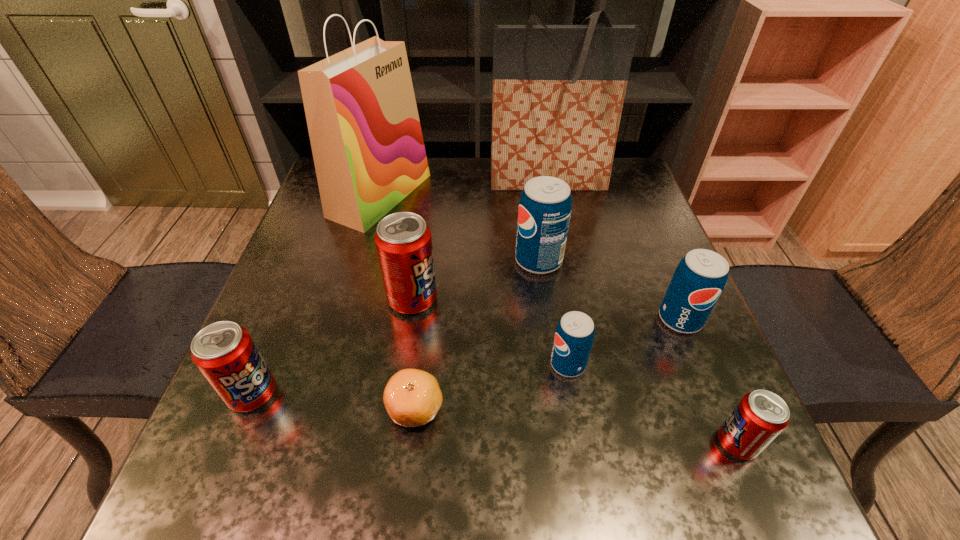
At what (x,y) coordinates should I click in order to perform the action: click on the left shopping bag. Please return your answer as a coordinate pair (x, y). Looking at the image, I should click on point(364,128).

Where is `the right shopping bag`? This screenshot has height=540, width=960. the right shopping bag is located at coordinates (558, 91).

This screenshot has width=960, height=540. I want to click on the biggest blue pop, so click(x=545, y=206).

Locate an element on the screen. The width and height of the screenshot is (960, 540). the farthest blue pop is located at coordinates (545, 206).

At what (x,y) coordinates should I click in order to perform the action: click on the fifth soda can from right to left. Please return your answer as a coordinate pair (x, y). The height and width of the screenshot is (540, 960). Looking at the image, I should click on (403, 241).

Find the location of a particular element. The height and width of the screenshot is (540, 960). the farthest red soda can is located at coordinates (403, 241).

Image resolution: width=960 pixels, height=540 pixels. I want to click on the rightmost blue pop, so click(x=699, y=279).

The height and width of the screenshot is (540, 960). Identify the location of the second smallest blue pop. (699, 279).

In order to click on the leftmost red soda can in this screenshot , I will do `click(224, 352)`.

Image resolution: width=960 pixels, height=540 pixels. Find the location of `the leftmost soda can`. the leftmost soda can is located at coordinates (224, 352).